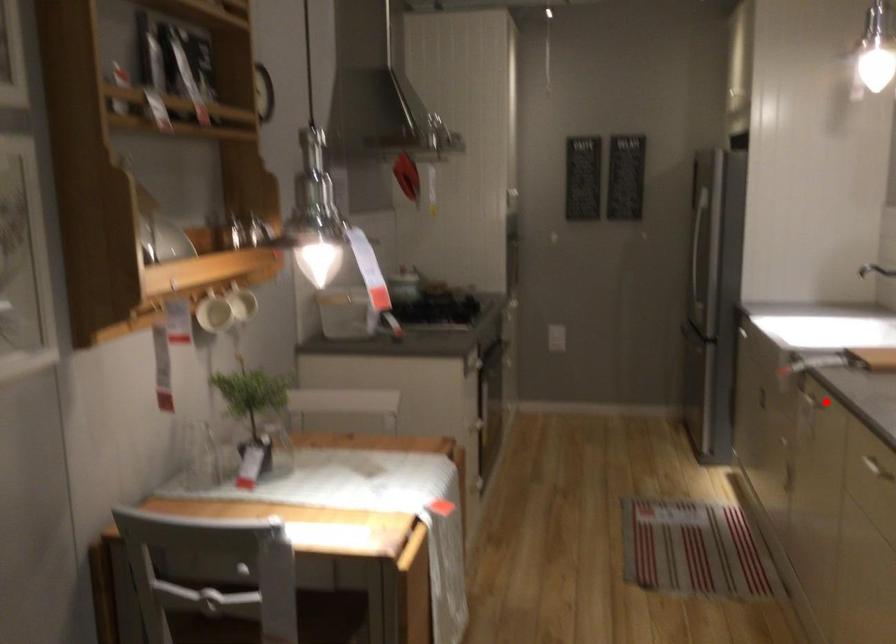
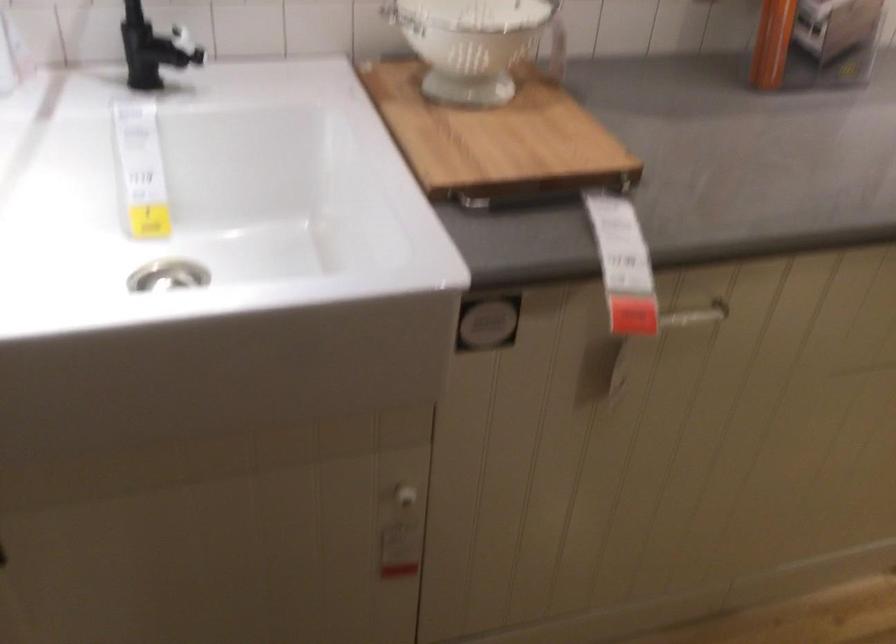
Where in the second image is the point corresponding to the highlighted location from the first image?

(695, 315)